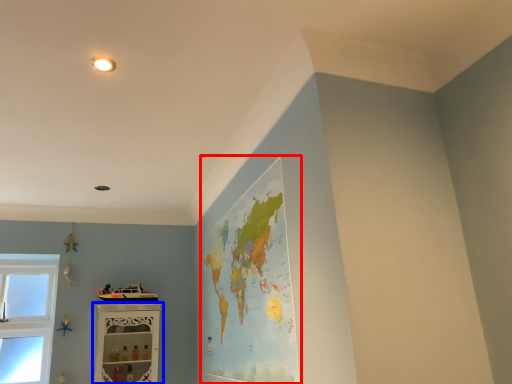
Question: Which point is closer to the camera, map (highlighted by a red box) or shelf (highlighted by a blue box)?

Choices:
 (A) map
 (B) shelf

Answer: (A)